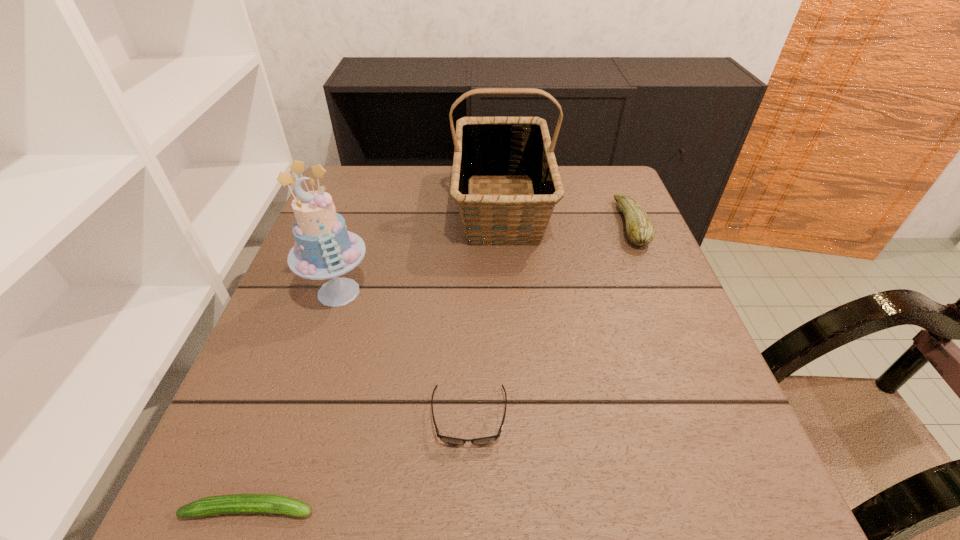
Locate an element on the screen. The width and height of the screenshot is (960, 540). basket is located at coordinates (485, 147).

This screenshot has height=540, width=960. Find the location of `the third nearest object`. the third nearest object is located at coordinates (324, 248).

Find the location of a particular element. The width and height of the screenshot is (960, 540). the rightmost object is located at coordinates (640, 230).

Locate an element on the screen. Image resolution: width=960 pixels, height=540 pixels. the third tallest object is located at coordinates 640,230.

Find the location of a particular element. the fourth tallest object is located at coordinates (448, 440).

Find the location of a particular element. This screenshot has width=960, height=540. sunglasses is located at coordinates (448, 440).

Where is `the nearest object`? The width and height of the screenshot is (960, 540). the nearest object is located at coordinates (236, 503).

Identify the location of the nearer zucchini. (236, 503).

In order to click on vacant space located 0.180m by the handle of the basket in this screenshot , I will do `click(510, 314)`.

The width and height of the screenshot is (960, 540). Find the location of `free space located 0.090m with a ladder on the side of the third nearest object`. free space located 0.090m with a ladder on the side of the third nearest object is located at coordinates (318, 354).